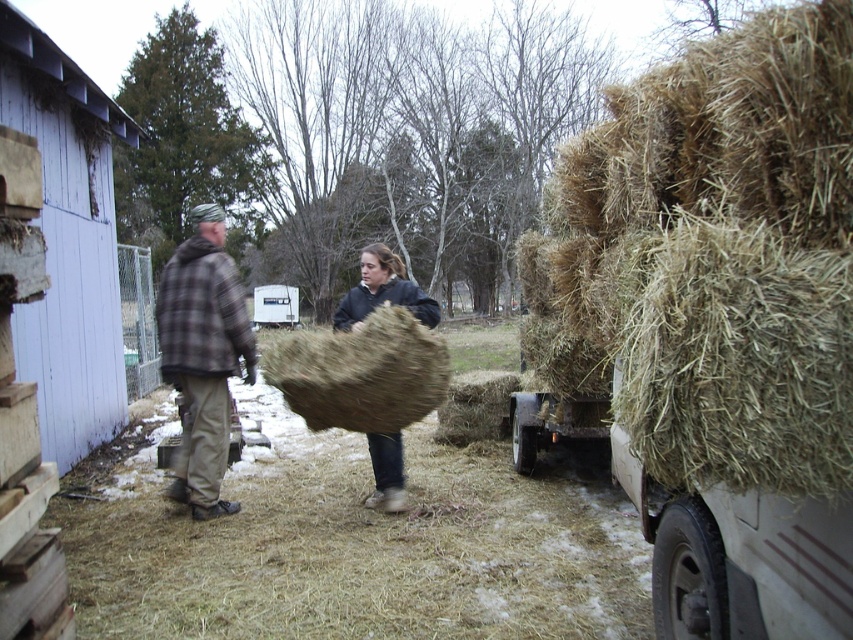
Between point (199, 513) and point (413, 305), which one is positioned in front?

Point (199, 513) is in front.

Does plaid fabric jacket at left have a smaller size compared to brown plaid shirt at center?

Correct, plaid fabric jacket at left occupies less space than brown plaid shirt at center.

Who is more forward, [224,396] or [345,304]?

Point [224,396] is more forward.

I want to click on plaid fabric jacket at left, so (x=202, y=356).

Who is lower down, brown straw bales at right or plaid fabric jacket at left?

plaid fabric jacket at left

Which is more to the right, brown straw bales at right or plaid fabric jacket at left?

From the viewer's perspective, brown straw bales at right appears more on the right side.

Find the location of a particular element. brown straw bales at right is located at coordinates (712, 257).

Can you confirm if brown straw bales at right is positioned to the left of dark brown woolen sweater at center?

Incorrect, brown straw bales at right is not on the left side of dark brown woolen sweater at center.

Who is positioned more to the left, brown straw bales at right or dark brown woolen sweater at center?

Positioned to the left is dark brown woolen sweater at center.

Is point (738, 150) positioned in front of point (363, 260)?

Yes, point (738, 150) is in front of point (363, 260).

Where is `brown straw bales at right`? The image size is (853, 640). brown straw bales at right is located at coordinates (712, 257).